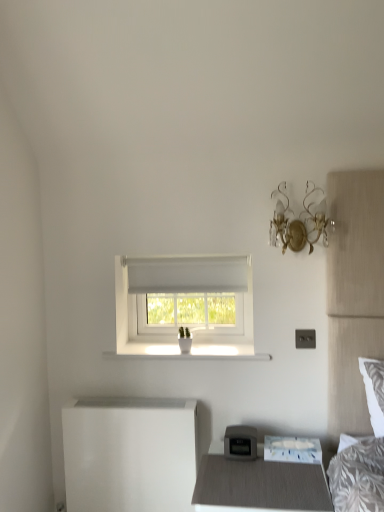
Question: Can you confirm if matte gray nightstand at lower center is shorter than white glossy changing table at lower left?

Choices:
 (A) no
 (B) yes

Answer: (B)

Question: Is matte gray nightstand at lower center to the left of white glossy changing table at lower left from the viewer's perspective?

Choices:
 (A) yes
 (B) no

Answer: (B)

Question: Is matte gray nightstand at lower center not near white glossy changing table at lower left?

Choices:
 (A) no
 (B) yes

Answer: (A)

Question: From the image's perspective, does matte gray nightstand at lower center appear lower than white glossy changing table at lower left?

Choices:
 (A) yes
 (B) no

Answer: (A)

Question: Is matte gray nightstand at lower center next to white glossy changing table at lower left?

Choices:
 (A) no
 (B) yes

Answer: (A)

Question: Is matte gray nightstand at lower center outside white glossy changing table at lower left?

Choices:
 (A) no
 (B) yes

Answer: (B)

Question: Can you confirm if white glossy changing table at lower left is bigger than white fabric window at center?

Choices:
 (A) yes
 (B) no

Answer: (B)

Question: Can you confirm if white glossy changing table at lower left is positioned to the left of white fabric window at center?

Choices:
 (A) no
 (B) yes

Answer: (B)

Question: Is white glossy changing table at lower left thinner than white fabric window at center?

Choices:
 (A) no
 (B) yes

Answer: (B)

Question: Is white glossy changing table at lower left smaller than white fabric window at center?

Choices:
 (A) no
 (B) yes

Answer: (B)

Question: Is white glossy changing table at lower left to the right of white fabric window at center from the viewer's perspective?

Choices:
 (A) no
 (B) yes

Answer: (A)

Question: From a real-world perspective, is white glossy changing table at lower left over white fabric window at center?

Choices:
 (A) yes
 (B) no

Answer: (B)

Question: From the image's perspective, is white glossy changing table at lower left beneath matte gray nightstand at lower center?

Choices:
 (A) yes
 (B) no

Answer: (B)